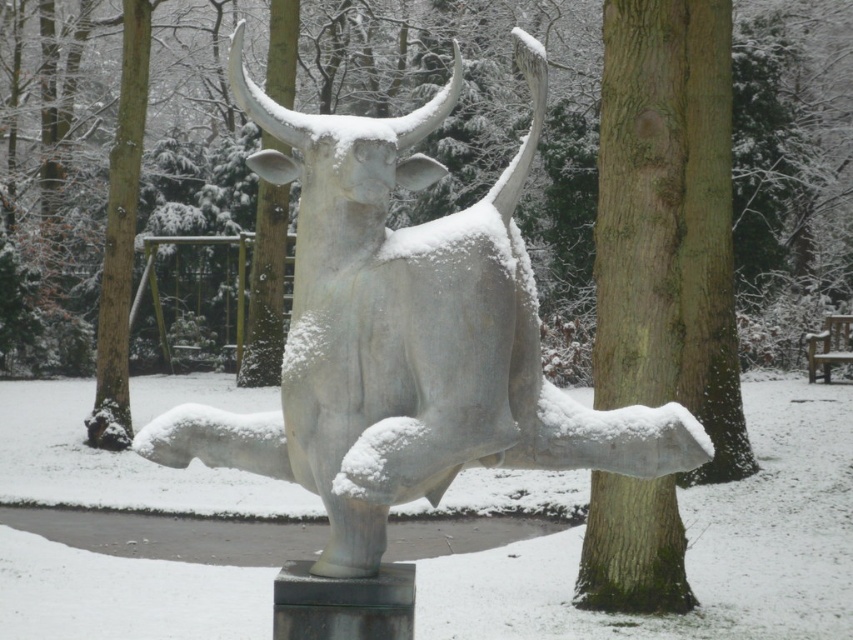
Is white marble bull at center positioned before smooth bark tree at center?

Yes.

Can you confirm if white marble bull at center is positioned to the left of smooth bark tree at center?

Yes, white marble bull at center is to the left of smooth bark tree at center.

Is point (422, 470) positioned in front of point (666, 342)?

Yes.

Find the location of a particular element. The width and height of the screenshot is (853, 640). white marble bull at center is located at coordinates (407, 337).